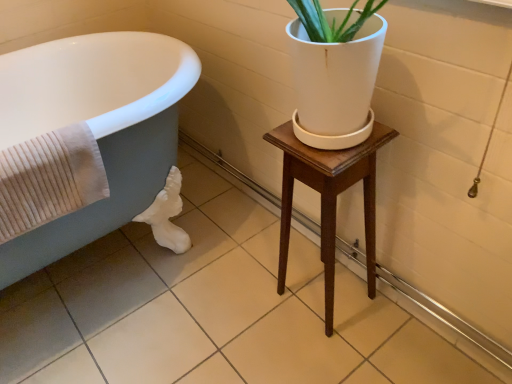
Question: Would you say matte gray bathtub at left is part of beige ribbed towel at left's contents?

Choices:
 (A) no
 (B) yes

Answer: (A)

Question: Is beige ribbed towel at left positioned behind matte gray bathtub at left?

Choices:
 (A) no
 (B) yes

Answer: (B)

Question: From a real-world perspective, is beige ribbed towel at left located higher than matte gray bathtub at left?

Choices:
 (A) yes
 (B) no

Answer: (A)

Question: Is the position of beige ribbed towel at left less distant than that of matte gray bathtub at left?

Choices:
 (A) yes
 (B) no

Answer: (B)

Question: Is beige ribbed towel at left at the right side of matte gray bathtub at left?

Choices:
 (A) no
 (B) yes

Answer: (B)

Question: From a real-world perspective, relative to matte gray bathtub at left, is wooden stool at center vertically above or below?

Choices:
 (A) below
 (B) above

Answer: (A)

Question: Is wooden stool at center situated inside matte gray bathtub at left or outside?

Choices:
 (A) inside
 (B) outside

Answer: (B)

Question: Looking at the image, does wooden stool at center seem bigger or smaller compared to matte gray bathtub at left?

Choices:
 (A) small
 (B) big

Answer: (A)

Question: From the image's perspective, is wooden stool at center positioned above or below matte gray bathtub at left?

Choices:
 (A) below
 (B) above

Answer: (A)

Question: Is beige ribbed towel at left bigger or smaller than wooden stool at center?

Choices:
 (A) big
 (B) small

Answer: (B)

Question: Considering the positions of beige ribbed towel at left and wooden stool at center in the image, is beige ribbed towel at left wider or thinner than wooden stool at center?

Choices:
 (A) wide
 (B) thin

Answer: (B)

Question: Does point (32, 188) appear closer or farther from the camera than point (371, 132)?

Choices:
 (A) farther
 (B) closer

Answer: (A)

Question: Choose the correct answer: Is beige ribbed towel at left inside wooden stool at center or outside it?

Choices:
 (A) outside
 (B) inside

Answer: (A)

Question: Considering the relative positions of matte gray bathtub at left and beige ribbed towel at left in the image provided, is matte gray bathtub at left to the left or to the right of beige ribbed towel at left?

Choices:
 (A) left
 (B) right

Answer: (A)

Question: Considering their positions, is matte gray bathtub at left located in front of or behind beige ribbed towel at left?

Choices:
 (A) front
 (B) behind

Answer: (A)